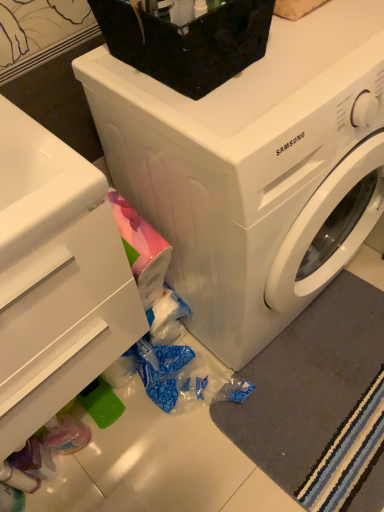
Where is `vacant area that is situated to the right of black plastic container at upper center`? This screenshot has width=384, height=512. vacant area that is situated to the right of black plastic container at upper center is located at coordinates (319, 49).